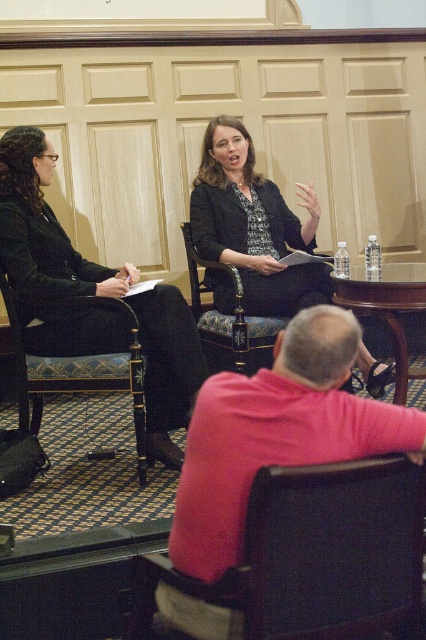
Question: Considering the real-world distances, which object is closest to the carved wood chair at center?

Choices:
 (A) matte black suit at upper center
 (B) pink fabric shirt at lower right
 (C) velvet upholstered chair at left
 (D) matte black blazer at center

Answer: (D)

Question: Can you confirm if velvet upholstered chair at left is bigger than carved wood chair at center?

Choices:
 (A) no
 (B) yes

Answer: (A)

Question: Among these points, which one is nearest to the camera?

Choices:
 (A) (49, 364)
 (B) (212, 285)
 (C) (215, 451)
 (D) (236, 307)

Answer: (C)

Question: In this image, where is matte black suit at upper center located relative to matte black blazer at center?

Choices:
 (A) left
 (B) right

Answer: (A)

Question: Considering the relative positions of pink fabric shirt at lower right and velvet upholstered chair at left in the image provided, where is pink fabric shirt at lower right located with respect to velvet upholstered chair at left?

Choices:
 (A) below
 (B) above

Answer: (A)

Question: Which point is farther to the camera?

Choices:
 (A) clear glass table at center
 (B) matte black blazer at center
 (C) carved wood chair at center
 (D) velvet upholstered chair at left

Answer: (B)